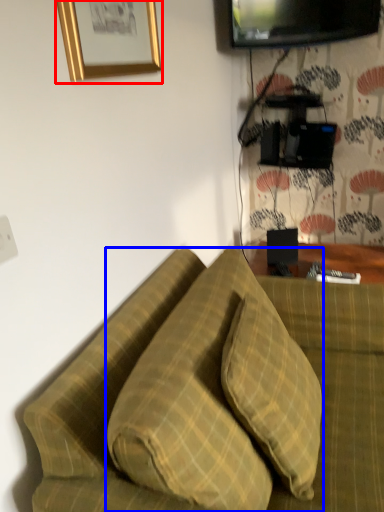
Question: Which point is further to the camera, picture frame (highlighted by a red box) or pillow (highlighted by a blue box)?

Choices:
 (A) picture frame
 (B) pillow

Answer: (A)